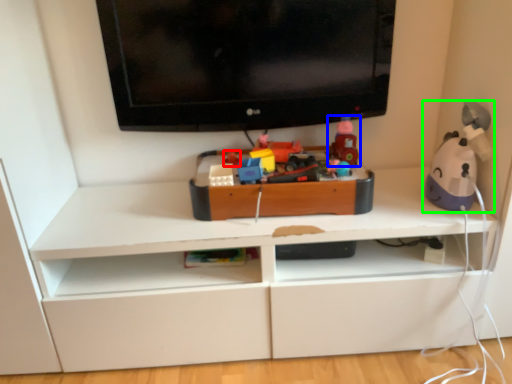
Question: Considering the real-world distances, which object is farthest from toy (highlighted by a red box)? toy (highlighted by a blue box) or toy (highlighted by a green box)?

Choices:
 (A) toy
 (B) toy

Answer: (B)